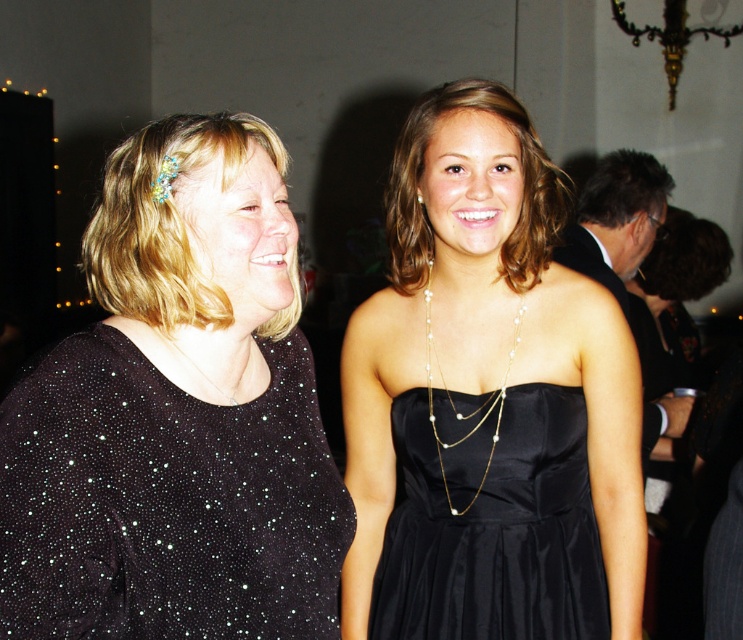
You are a photographer trying to capture a closeup shot of both the sparkly black dress at center and the pearl gold chain at center. Since you want both items to appear equally prominent in the photo, which one should you zoom in on more?

The sparkly black dress at center has a larger size compared to pearl gold chain at center, so to make them appear equally prominent in the photo, you should zoom in more on the pearl gold chain at center.

You are a photographer setting up for a photoshoot and need to position a lighting reflector. You have two items in the scene, the sparkly black dress at center and the pearl gold chain at center. Which item should you place the reflector behind to ensure proper lighting on the taller object?

The sparkly black dress at center is taller than the pearl gold chain at center, so you should place the reflector behind the sparkly black dress at center to ensure proper lighting on the taller object.